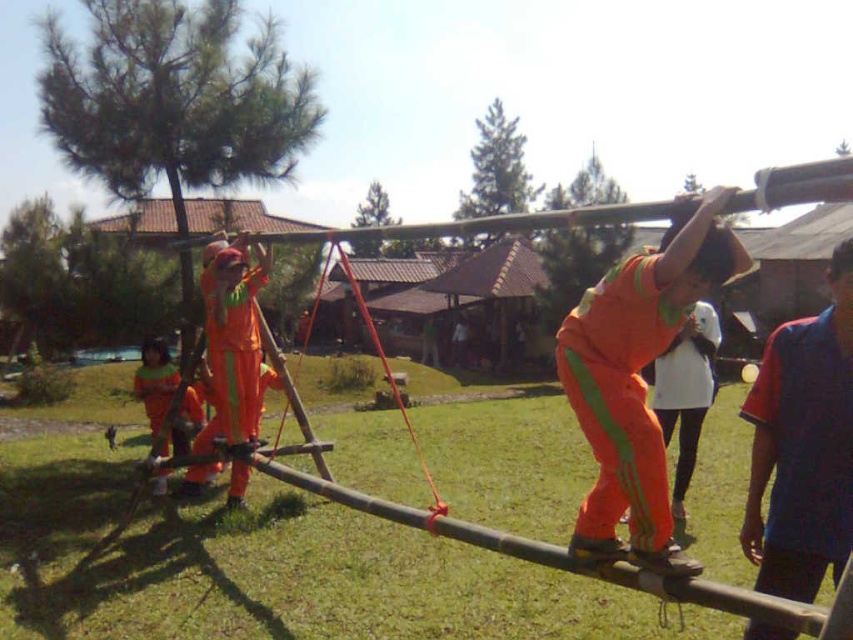
Question: Among these points, which one is nearest to the camera?

Choices:
 (A) (677, 556)
 (B) (776, 522)

Answer: (B)

Question: Can you confirm if orange fabric pants at center is positioned to the right of blue/red polo shirt at upper right?

Choices:
 (A) yes
 (B) no

Answer: (B)

Question: Does orange fabric pants at center appear on the left side of blue/red polo shirt at upper right?

Choices:
 (A) yes
 (B) no

Answer: (A)

Question: Does orange fabric pants at center have a smaller size compared to blue/red polo shirt at upper right?

Choices:
 (A) no
 (B) yes

Answer: (A)